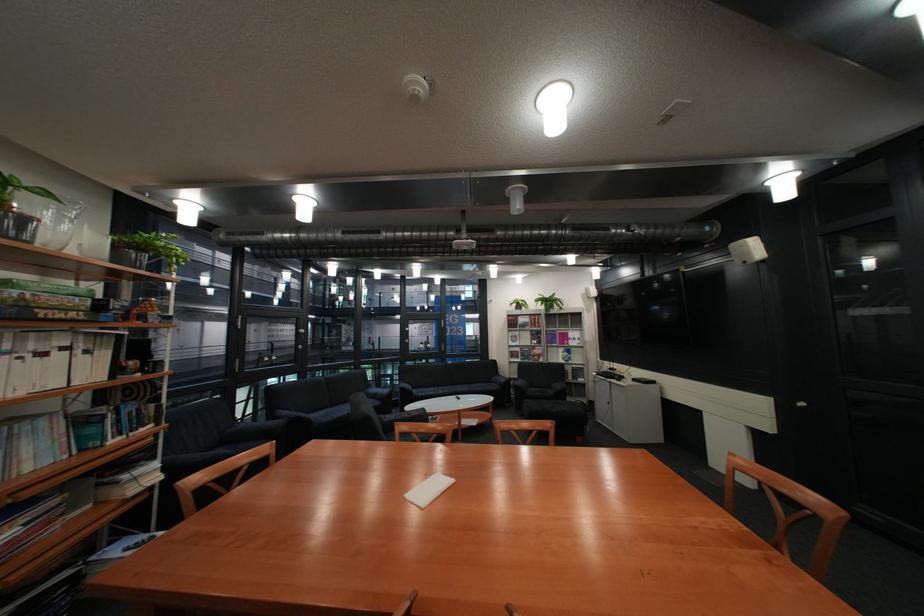
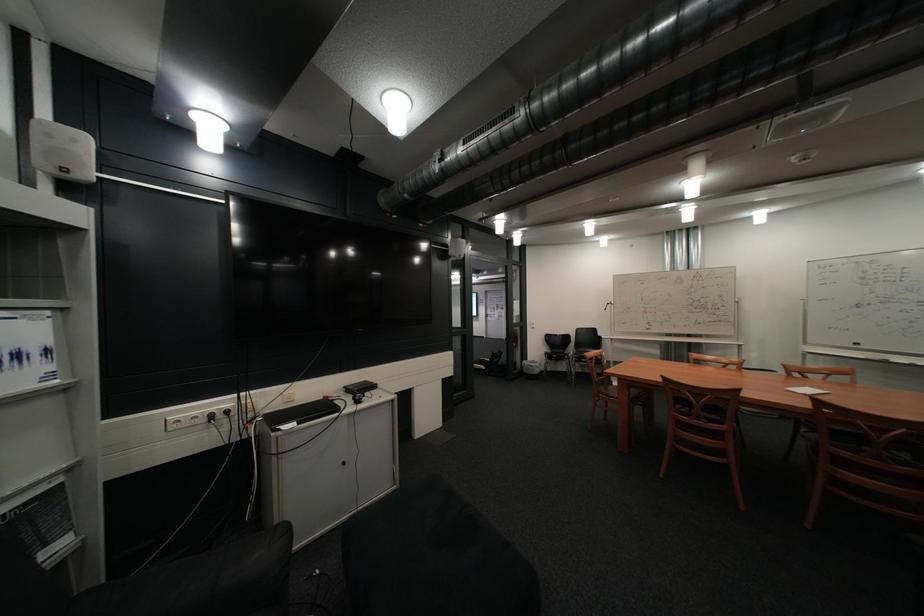
Locate, in the second image, the point that corresponds to (589,366) in the first image.

(10, 514)